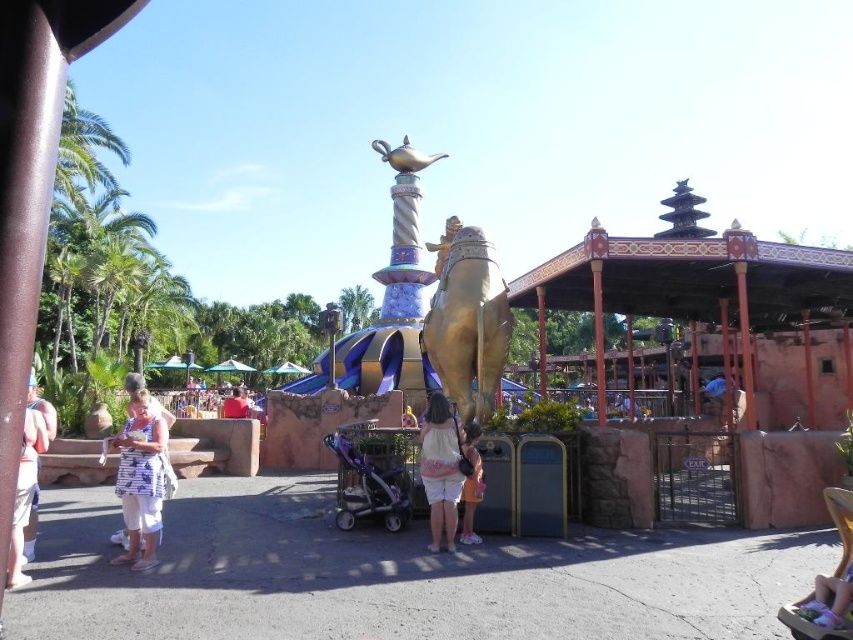
You are a photographer at the theme park and want to capture both the white printed dress at lower left and the white cotton dress at center in a single shot. Which dress is positioned more to the left side of the frame?

The white printed dress at lower left is positioned more to the left side of the frame compared to the white cotton dress at center.

You are a photographer standing at the entrance of the theme park. You want to take a picture of the gold metallic camel at center and the white printed dress at lower left. Which object should you adjust your camera to focus on first if you want to capture both in the frame without moving the camera?

The gold metallic camel at center is to the right of the white printed dress at lower left, so you should focus on the white printed dress at lower left first to ensure both are in frame without moving the camera.